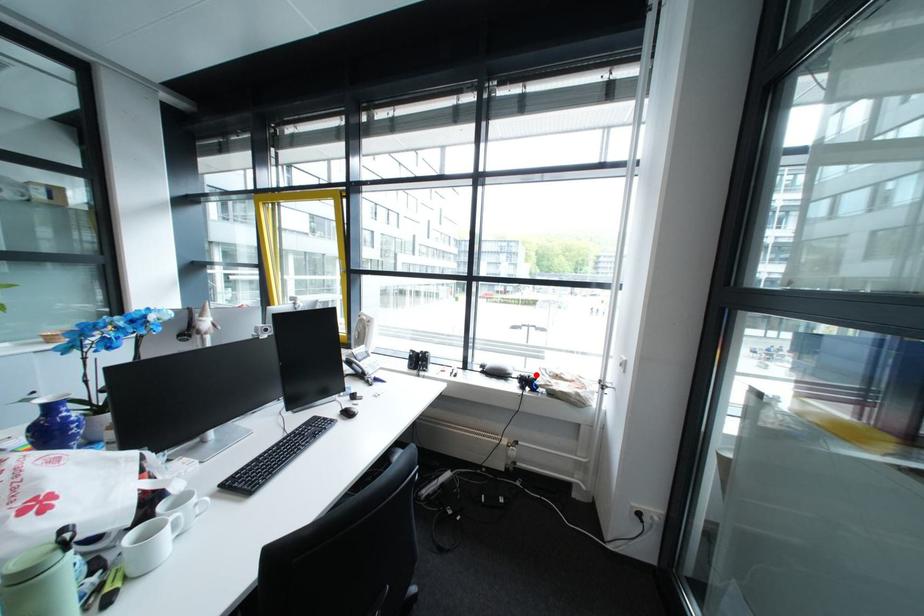
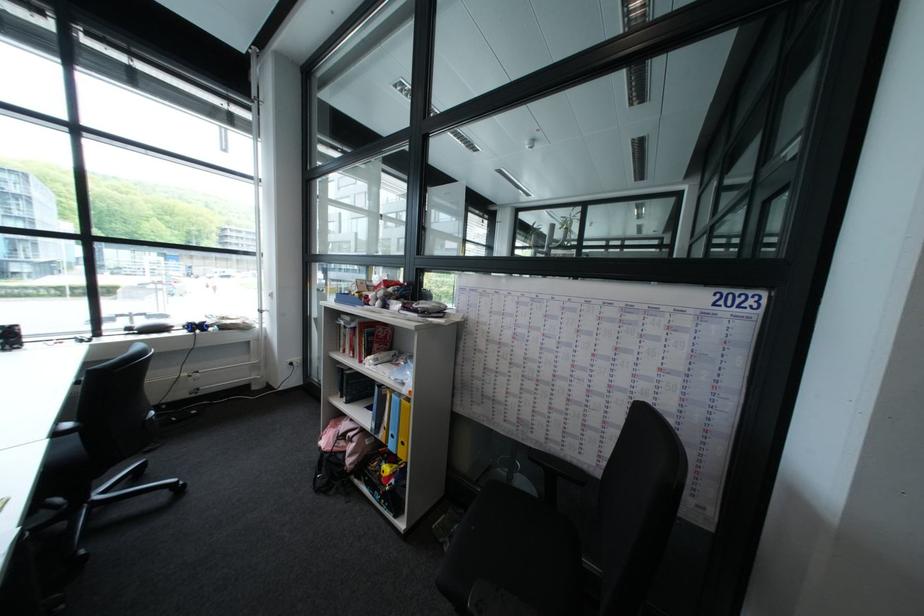
The point at the highlighted location is marked in the first image. Where is the corresponding point in the second image?

(203, 322)